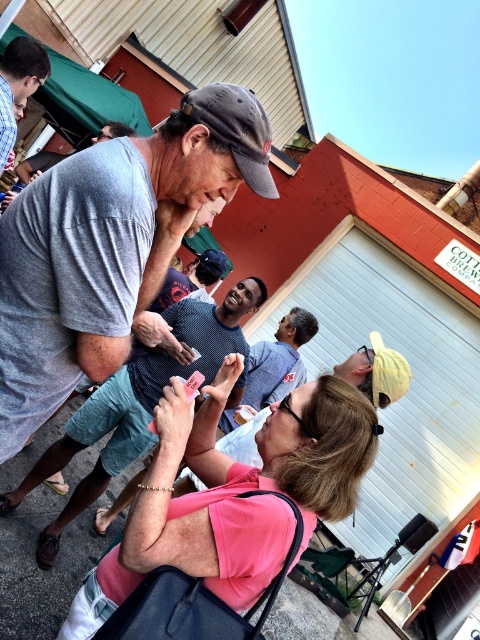
Who is lower down, matte black phone at center or matte gray shirt at center?

matte black phone at center is below.

This screenshot has height=640, width=480. What are the coordinates of `matte black phone at center` in the screenshot? It's located at (139, 403).

Which is above, gray cotton t-shirt at center or matte black phone at center?

gray cotton t-shirt at center is higher up.

Looking at this image, which is more to the right, gray cotton t-shirt at center or matte black phone at center?

gray cotton t-shirt at center is more to the right.

Which is in front, point (266, 168) or point (252, 276)?

Positioned in front is point (266, 168).

The height and width of the screenshot is (640, 480). What are the coordinates of `gray cotton t-shirt at center` in the screenshot? It's located at (x=110, y=244).

Can you confirm if pink matte shirt at center is smaller than matte gray shirt at center?

Actually, pink matte shirt at center might be larger than matte gray shirt at center.

Between pink matte shirt at center and matte gray shirt at center, which one has more height?

Standing taller between the two is matte gray shirt at center.

Where is `pink matte shirt at center`? pink matte shirt at center is located at coordinates (233, 493).